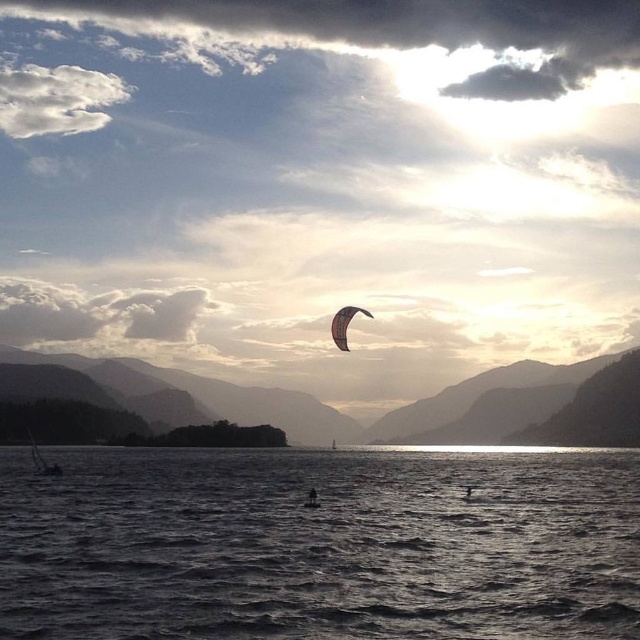
You are standing at the lakeside and see two points marked on the water surface. The first point is at coordinates point [214,580] and the second point is at point [308,496]. Which point is closer to you?

Point [214,580] is in front of point [308,496], so it is closer to you.

You are observing a lakeside scene with a dark skin person at center and a silhouette of person at center. Which object is closer to you based on their spatial relationship?

The dark skin person at center is closer to you because they are positioned over the silhouette of person at center, indicating it is in front.